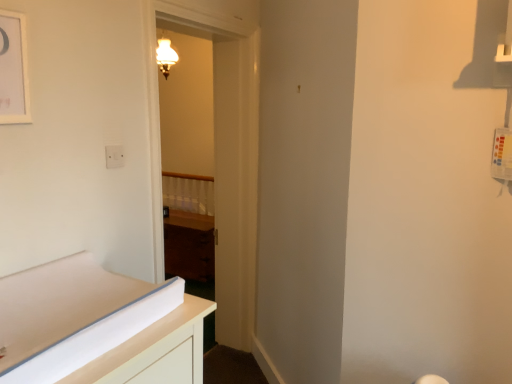
Question: From the image's perspective, is white plastic electric outlet at upper left on top of dark wood cabinet at center?

Choices:
 (A) yes
 (B) no

Answer: (A)

Question: From the image's perspective, is white plastic electric outlet at upper left under dark wood cabinet at center?

Choices:
 (A) yes
 (B) no

Answer: (B)

Question: From a real-world perspective, is white plastic electric outlet at upper left on dark wood cabinet at center?

Choices:
 (A) yes
 (B) no

Answer: (A)

Question: Is white plastic electric outlet at upper left bigger than dark wood cabinet at center?

Choices:
 (A) no
 (B) yes

Answer: (A)

Question: Is white plastic electric outlet at upper left looking in the opposite direction of dark wood cabinet at center?

Choices:
 (A) yes
 (B) no

Answer: (B)

Question: Would you say white plastic electric outlet at upper left is a long distance from dark wood cabinet at center?

Choices:
 (A) yes
 (B) no

Answer: (A)

Question: Does white matte picture frame at upper left have a larger size compared to white plastic electric outlet at upper left?

Choices:
 (A) no
 (B) yes

Answer: (B)

Question: Does white matte picture frame at upper left have a greater height compared to white plastic electric outlet at upper left?

Choices:
 (A) yes
 (B) no

Answer: (A)

Question: Is white matte picture frame at upper left positioned beyond the bounds of white plastic electric outlet at upper left?

Choices:
 (A) no
 (B) yes

Answer: (B)

Question: Considering the relative sizes of white matte picture frame at upper left and white plastic electric outlet at upper left in the image provided, is white matte picture frame at upper left shorter than white plastic electric outlet at upper left?

Choices:
 (A) yes
 (B) no

Answer: (B)

Question: Is white matte picture frame at upper left closer to the viewer compared to white plastic electric outlet at upper left?

Choices:
 (A) yes
 (B) no

Answer: (A)

Question: Is white plastic electric outlet at upper left inside white matte picture frame at upper left?

Choices:
 (A) no
 (B) yes

Answer: (A)

Question: Can you confirm if white matte picture frame at upper left is wider than wooden door at center?

Choices:
 (A) yes
 (B) no

Answer: (B)